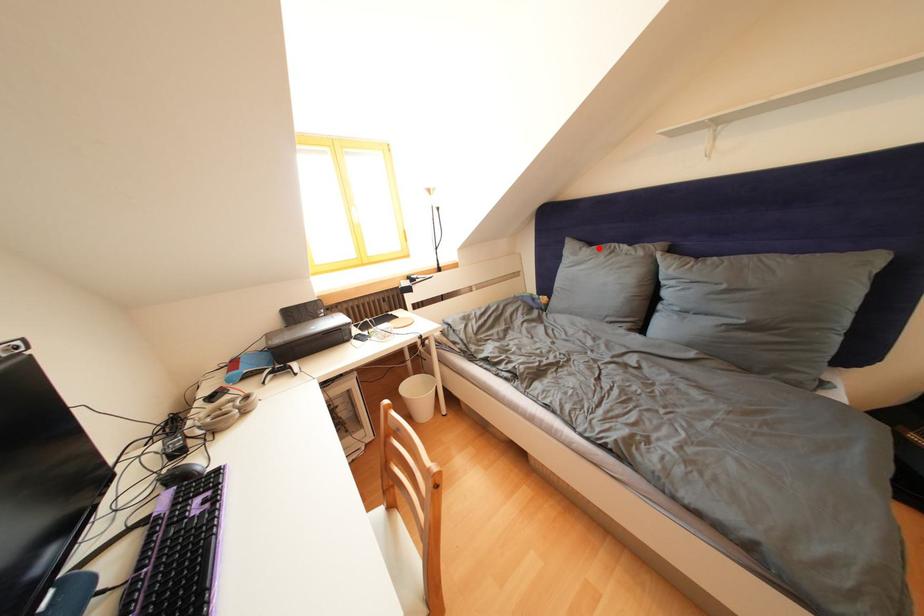
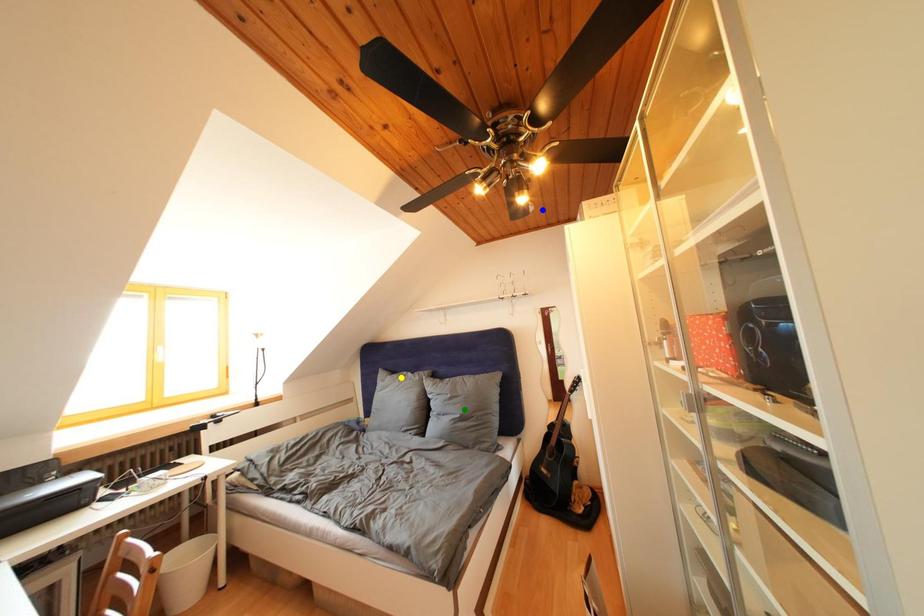
Question: I am providing you with two images of the same scene from different viewpoints. A red point is marked on the first image. You are given multiple points on the second image. Which mark in image 2 goes with the point in image 1?

Choices:
 (A) blue point
 (B) yellow point
 (C) green point

Answer: (B)